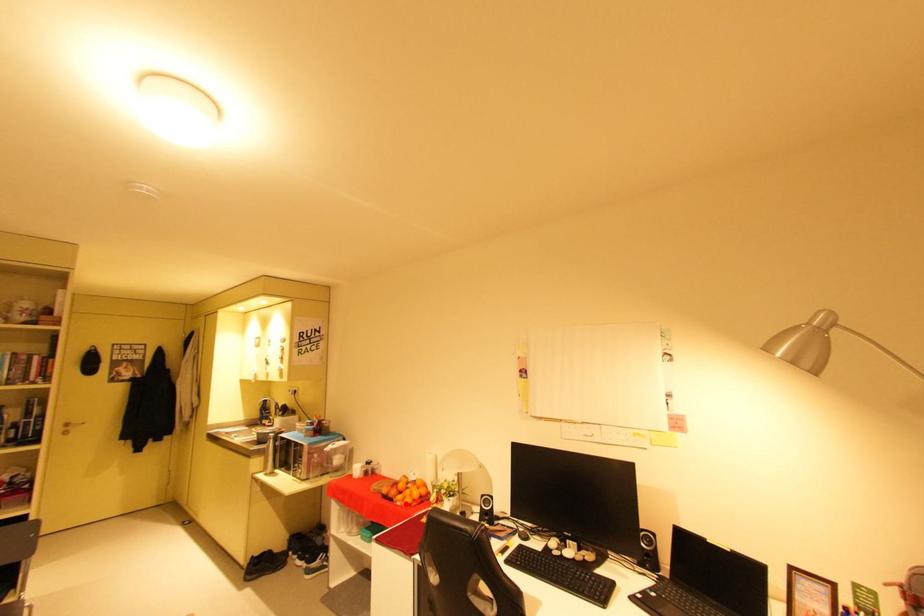
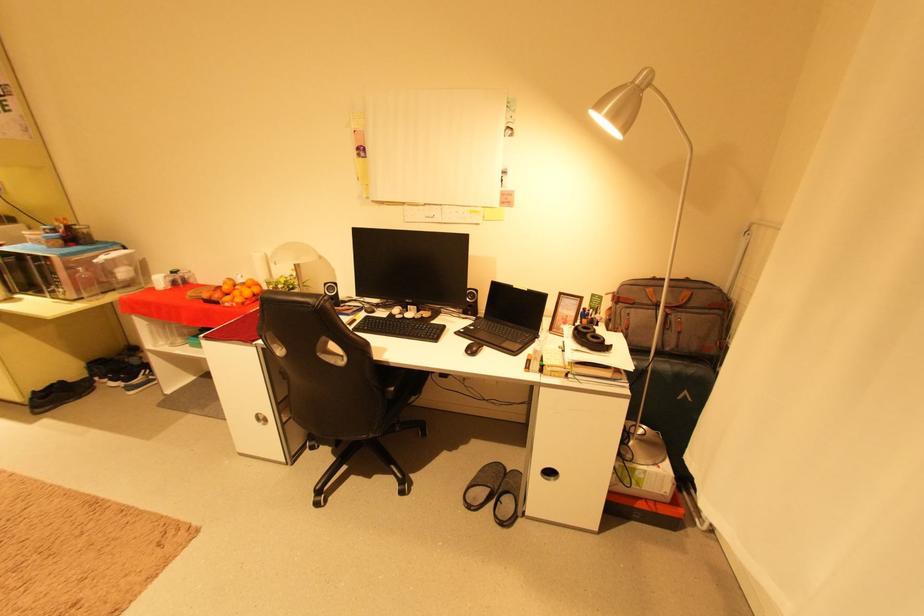
Find the pixel in the second image that matches the highlighted location in the first image.

(235, 305)